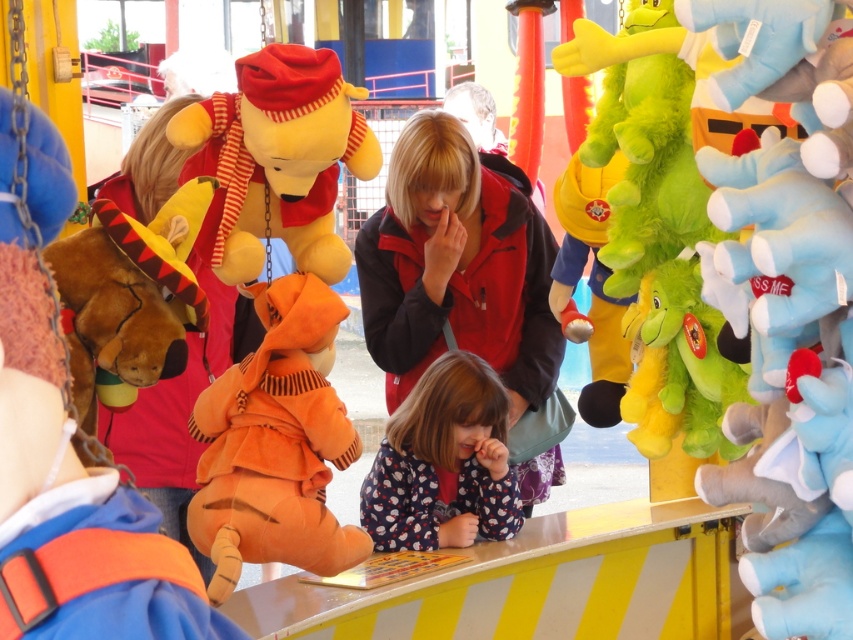
Question: Is fluffy red jacket at center above dotted fabric dress at center?

Choices:
 (A) no
 (B) yes

Answer: (B)

Question: Which of the following is the farthest from the observer?

Choices:
 (A) (198, 109)
 (B) (83, 237)
 (C) (642, 323)
 (D) (299, 371)

Answer: (C)

Question: Is yellow plush bear at center wider than dotted fabric dress at center?

Choices:
 (A) yes
 (B) no

Answer: (B)

Question: Which of the following is the farthest from the observer?

Choices:
 (A) yellow plush bear at center
 (B) fluffy red jacket at center

Answer: (B)

Question: Which object is closer to the camera taking this photo?

Choices:
 (A) orange plush tiger at center
 (B) brown plush bear at left
 (C) yellow plush bear at center
 (D) dotted fabric dress at center

Answer: (B)

Question: In this image, where is dotted fabric dress at center located relative to green plush toy at right?

Choices:
 (A) below
 (B) above

Answer: (A)